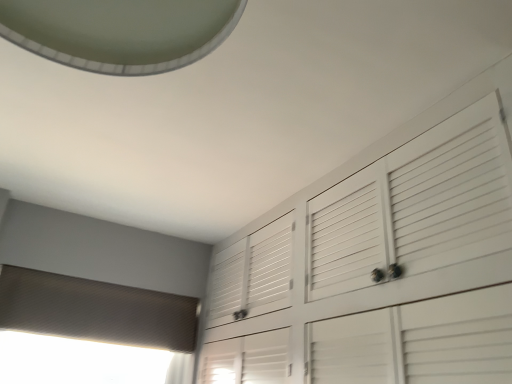
Identify the location of white glossy exhaust hood at upper left. This screenshot has width=512, height=384. (120, 32).

Measure the distance between point (41, 40) and camera.

The depth of point (41, 40) is 68.30 centimeters.

Describe the element at coordinates (120, 32) in the screenshot. I see `white glossy exhaust hood at upper left` at that location.

What is the approximate height of white glossy exhaust hood at upper left?

The height of white glossy exhaust hood at upper left is 12.77 inches.

What is the approximate width of white glossy exhaust hood at upper left?

white glossy exhaust hood at upper left is 11.20 inches in width.

The image size is (512, 384). Identify the location of textured gray blind at lower left. (96, 310).

The height and width of the screenshot is (384, 512). What do you see at coordinates (96, 310) in the screenshot? I see `textured gray blind at lower left` at bounding box center [96, 310].

This screenshot has height=384, width=512. I want to click on white glossy exhaust hood at upper left, so click(120, 32).

Based on the photo, visually, is white glossy exhaust hood at upper left positioned to the left or to the right of textured gray blind at lower left?

white glossy exhaust hood at upper left is positioned on textured gray blind at lower left's right side.

Which is behind, white glossy exhaust hood at upper left or textured gray blind at lower left?

textured gray blind at lower left is behind.

Does point (41, 44) lie behind point (82, 299)?

No.

From the image's perspective, is white glossy exhaust hood at upper left positioned above or below textured gray blind at lower left?

Clearly, from the image's perspective, white glossy exhaust hood at upper left is above textured gray blind at lower left.

From a real-world perspective, which object rests below the other?

In real-world perspective, textured gray blind at lower left is lower.

Considering the sizes of objects white glossy exhaust hood at upper left and textured gray blind at lower left in the image provided, who is thinner, white glossy exhaust hood at upper left or textured gray blind at lower left?

textured gray blind at lower left.

Who is shorter, white glossy exhaust hood at upper left or textured gray blind at lower left?

textured gray blind at lower left.

Considering the relative sizes of white glossy exhaust hood at upper left and textured gray blind at lower left in the image provided, is white glossy exhaust hood at upper left bigger than textured gray blind at lower left?

Indeed, white glossy exhaust hood at upper left has a larger size compared to textured gray blind at lower left.

Could textured gray blind at lower left be considered to be inside white glossy exhaust hood at upper left?

No.

Based on the photo, is white glossy exhaust hood at upper left not near textured gray blind at lower left?

Absolutely, white glossy exhaust hood at upper left is distant from textured gray blind at lower left.

Could you tell me if white glossy exhaust hood at upper left is turned towards textured gray blind at lower left?

No, white glossy exhaust hood at upper left is not aimed at textured gray blind at lower left.

How much distance is there between white glossy exhaust hood at upper left and textured gray blind at lower left?

white glossy exhaust hood at upper left is 1.75 meters away from textured gray blind at lower left.

Identify the location of blind below the white glossy exhaust hood at upper left (from a real-world perspective). This screenshot has height=384, width=512. [96, 310].

Considering the relative positions of textured gray blind at lower left and white glossy exhaust hood at upper left in the image provided, is textured gray blind at lower left to the left of white glossy exhaust hood at upper left from the viewer's perspective?

Correct, you'll find textured gray blind at lower left to the left of white glossy exhaust hood at upper left.

Considering the positions of objects textured gray blind at lower left and white glossy exhaust hood at upper left in the image provided, who is in front, textured gray blind at lower left or white glossy exhaust hood at upper left?

white glossy exhaust hood at upper left is closer to the camera.

Which point is more distant from viewer, (x=151, y=323) or (x=100, y=10)?

The point (x=151, y=323) is more distant.

From the image's perspective, does textured gray blind at lower left appear higher than white glossy exhaust hood at upper left?

No, from the image's perspective, textured gray blind at lower left is not on top of white glossy exhaust hood at upper left.

Based on the photo, from a real-world perspective, between textured gray blind at lower left and white glossy exhaust hood at upper left, who is vertically higher?

white glossy exhaust hood at upper left is physically above.

Consider the image. Which object is thinner, textured gray blind at lower left or white glossy exhaust hood at upper left?

textured gray blind at lower left.

Who is shorter, textured gray blind at lower left or white glossy exhaust hood at upper left?

With less height is textured gray blind at lower left.

Looking at the image, does textured gray blind at lower left seem bigger or smaller compared to white glossy exhaust hood at upper left?

Clearly, textured gray blind at lower left is smaller in size than white glossy exhaust hood at upper left.

Is textured gray blind at lower left inside or outside of white glossy exhaust hood at upper left?

textured gray blind at lower left is outside white glossy exhaust hood at upper left.

Is the surface of textured gray blind at lower left in direct contact with white glossy exhaust hood at upper left?

No, textured gray blind at lower left is not in contact with white glossy exhaust hood at upper left.

Could you tell me if textured gray blind at lower left is facing white glossy exhaust hood at upper left?

Yes, textured gray blind at lower left is turned towards white glossy exhaust hood at upper left.

Measure the distance between textured gray blind at lower left and white glossy exhaust hood at upper left.

They are 5.75 feet apart.

Identify the location of exhaust hood above the textured gray blind at lower left (from a real-world perspective). (120, 32).

The height and width of the screenshot is (384, 512). Identify the location of blind that is on the left side of white glossy exhaust hood at upper left. (96, 310).

Locate an element on the screen. The image size is (512, 384). exhaust hood positioned vertically above the textured gray blind at lower left (from a real-world perspective) is located at coordinates (120, 32).